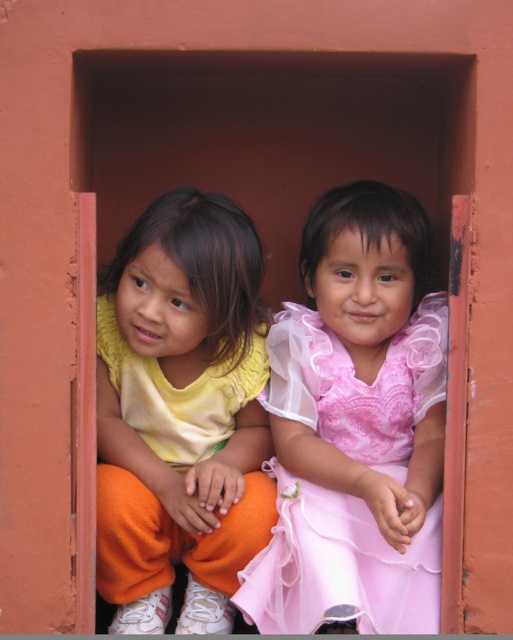
You are a tailor trying to determine which clothing item requires more fabric for alterations. Based on the scene, which item is thinner between the matte yellow shirt at left and the pink sheer dress at center?

The matte yellow shirt at left is thinner than the pink sheer dress at center, so it would require less fabric for alterations since it is thinner.

You are a photographer trying to capture a photo of the matte yellow shirt at left and the pink sheer dress at center. Based on their positions, which one should you focus on first if you want to ensure both are in the frame without moving the camera?

The matte yellow shirt at left is located above the pink sheer dress at center, so you should focus on the pink sheer dress at center first to ensure both are in the frame without moving the camera.